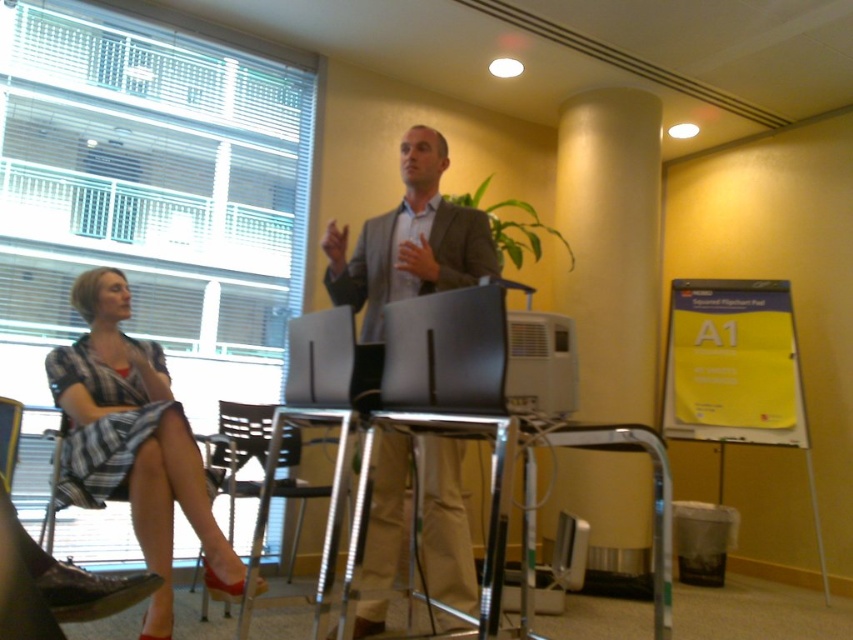
In the scene shown: Is striped cotton dress at left bigger than metallic silver chair at lower left?

Yes, striped cotton dress at left is bigger than metallic silver chair at lower left.

Who is lower down, striped cotton dress at left or metallic silver chair at lower left?

Positioned lower is striped cotton dress at left.

What do you see at coordinates (132, 442) in the screenshot? I see `striped cotton dress at left` at bounding box center [132, 442].

Identify the location of striped cotton dress at left. (132, 442).

From the picture: Who is positioned more to the right, striped cotton dress at left or metallic silver table at center?

metallic silver table at center

Consider the image. Between striped cotton dress at left and metallic silver table at center, which one is positioned lower?

Positioned lower is striped cotton dress at left.

Between point (149, 600) and point (669, 634), which one is positioned behind?

The point (149, 600) is behind.

At what (x,y) coordinates should I click in order to perform the action: click on striped cotton dress at left. Please return your answer as a coordinate pair (x, y). The height and width of the screenshot is (640, 853). Looking at the image, I should click on (132, 442).

Which is above, matte gray suit at center or satin black laptop at center?

matte gray suit at center is above.

Who is positioned more to the left, matte gray suit at center or satin black laptop at center?

matte gray suit at center is more to the left.

Which is behind, point (457, 520) or point (416, 360)?

Positioned behind is point (457, 520).

Identify the location of matte gray suit at center. (409, 241).